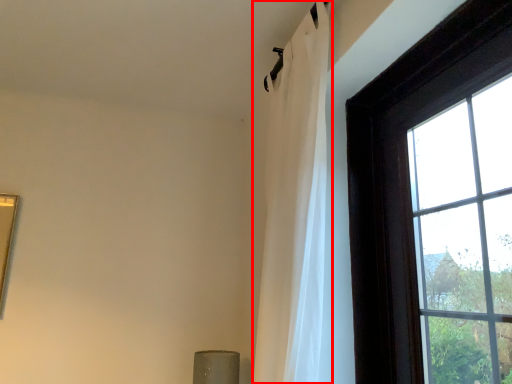
Question: From the image, what is the correct spatial relationship of curtain (annotated by the red box) in relation to window?

Choices:
 (A) left
 (B) right

Answer: (A)